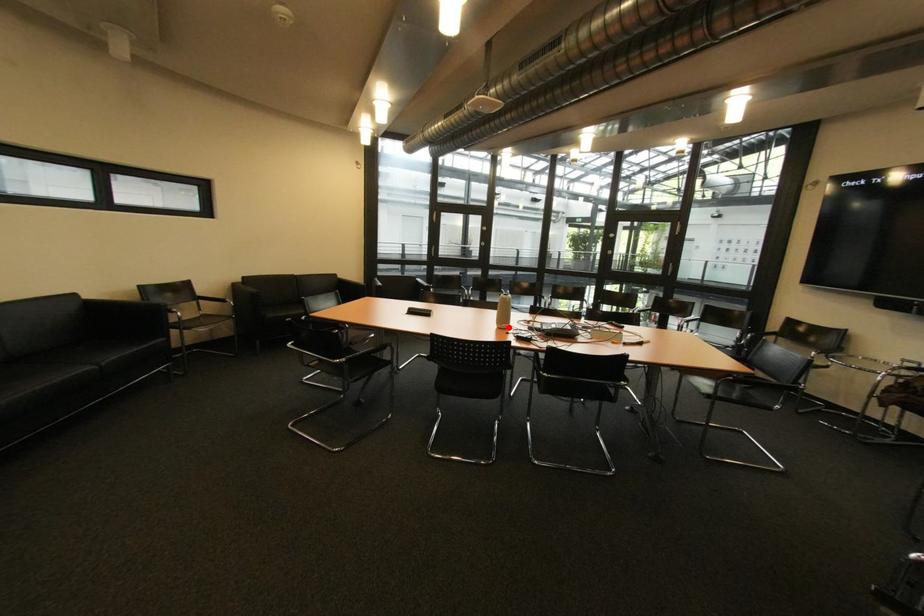
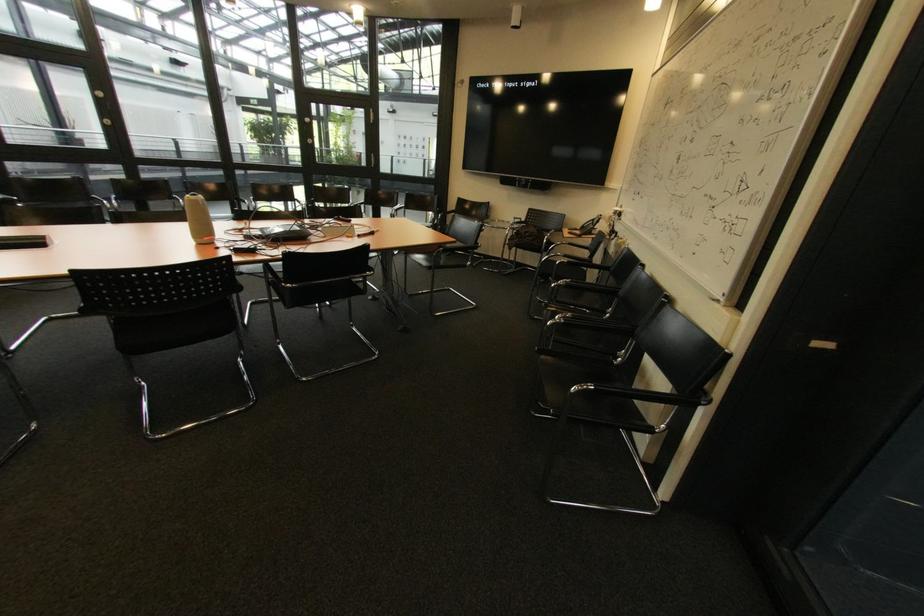
Where in the second image is the point corresponding to the highlighted location from the first image?

(210, 243)